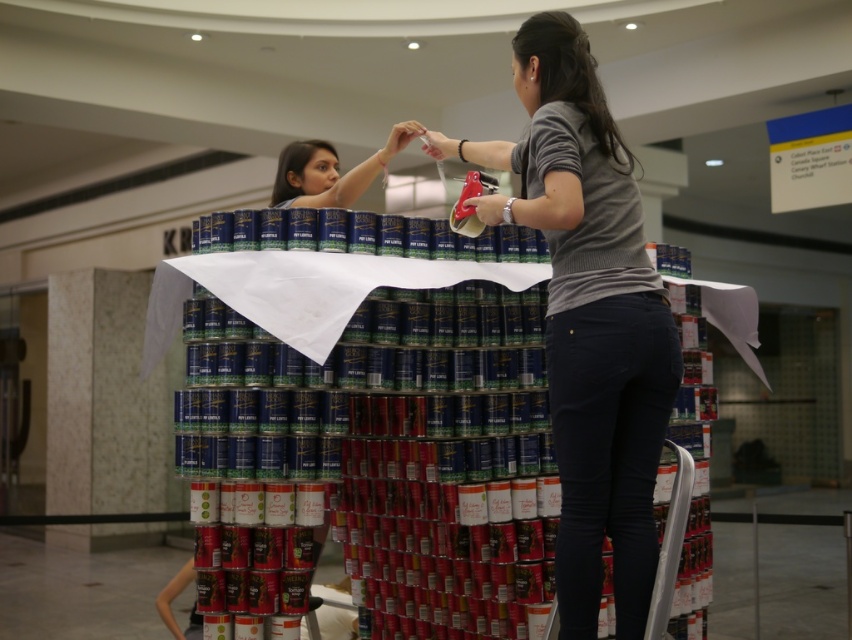
Which is above, matte black can at center or matte black hair at upper center?

matte black can at center

Can you confirm if matte black can at center is thinner than matte black hair at upper center?

Indeed, matte black can at center has a lesser width compared to matte black hair at upper center.

The width and height of the screenshot is (852, 640). What do you see at coordinates (332, 170) in the screenshot?
I see `matte black can at center` at bounding box center [332, 170].

Locate an element on the screen. The image size is (852, 640). matte black can at center is located at coordinates (332, 170).

Locate an element on the screen. gray knit sweater at center is located at coordinates (588, 317).

Between point (597, 161) and point (327, 193), which one is positioned behind?

The point (327, 193) is more distant.

The image size is (852, 640). What do you see at coordinates (588, 317) in the screenshot?
I see `gray knit sweater at center` at bounding box center [588, 317].

At what (x,y) coordinates should I click in order to perform the action: click on gray knit sweater at center. Please return your answer as a coordinate pair (x, y). Looking at the image, I should click on (588, 317).

Can you confirm if gray knit sweater at center is positioned to the left of matte black can at center?

In fact, gray knit sweater at center is to the right of matte black can at center.

Who is more forward, (586, 492) or (384, 170)?

Point (586, 492)

Find the location of a particular element. The image size is (852, 640). gray knit sweater at center is located at coordinates (588, 317).